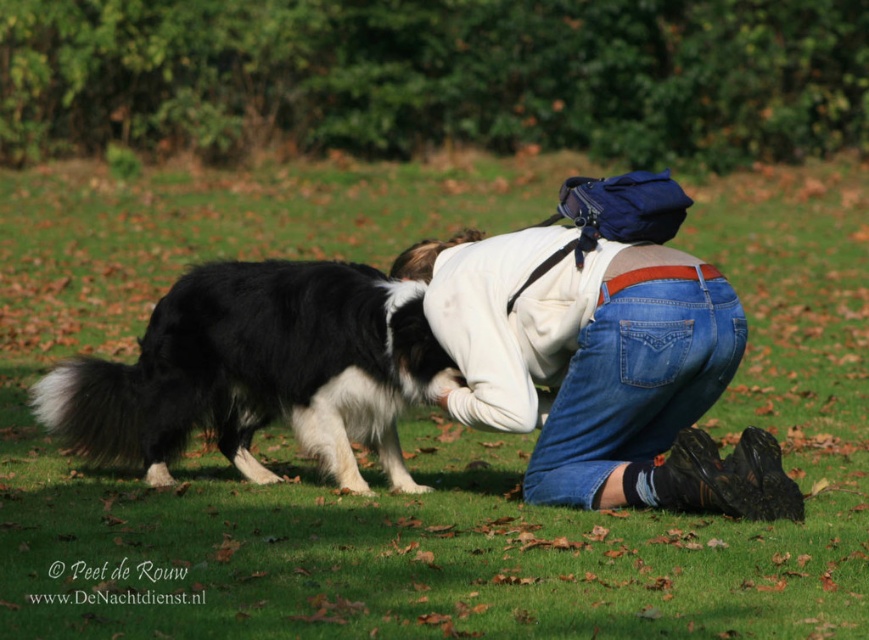
Question: Does denim jeans at center have a lesser width compared to black and white fur at lower left?

Choices:
 (A) yes
 (B) no

Answer: (A)

Question: Is denim jeans at center positioned at the back of black and white fur at lower left?

Choices:
 (A) no
 (B) yes

Answer: (A)

Question: Is denim jeans at center above black and white fur at lower left?

Choices:
 (A) no
 (B) yes

Answer: (B)